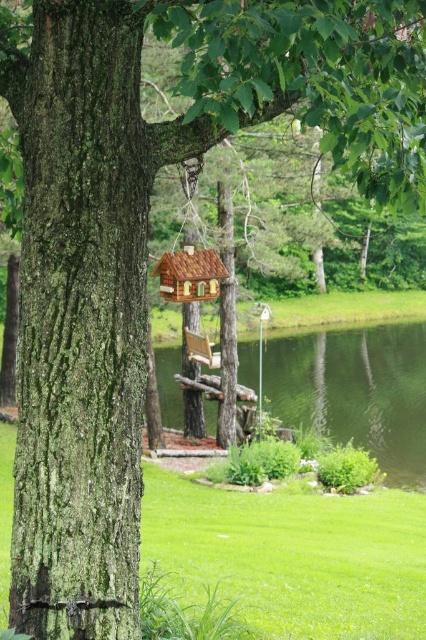
Question: Which point appears closest to the camera in this image?

Choices:
 (A) (189, 340)
 (B) (161, 264)
 (C) (71, 387)

Answer: (C)

Question: Which point is farther from the camera taking this photo?

Choices:
 (A) (408, 381)
 (B) (166, 284)
 (C) (37, 214)
 (D) (215, 360)

Answer: (A)

Question: Does green grassy lake at center lie behind wooden swing at center?

Choices:
 (A) yes
 (B) no

Answer: (B)

Question: Is green mossy bark at center bigger than green grassy lake at center?

Choices:
 (A) no
 (B) yes

Answer: (A)

Question: Where is brown wooden bird feeder at center located in relation to wooden swing at center in the image?

Choices:
 (A) below
 (B) above

Answer: (B)

Question: Estimate the real-world distances between objects in this image. Which object is farther from the wooden swing at center?

Choices:
 (A) green mossy bark at center
 (B) brown wooden bird feeder at center
 (C) green grassy lake at center

Answer: (A)